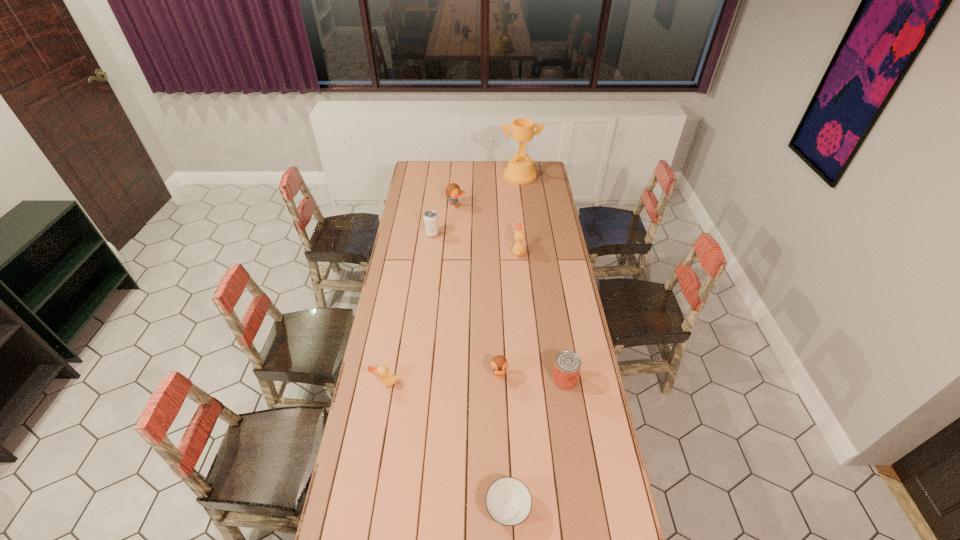
Where is `vacant region located 0.170m on the front of the third farthest object`? vacant region located 0.170m on the front of the third farthest object is located at coordinates (429, 260).

Locate an element on the screen. This screenshot has width=960, height=540. vacant region located on the back of the can is located at coordinates click(553, 307).

This screenshot has height=540, width=960. I want to click on free space located on the front-facing side of the smaller blue duck, so click(503, 487).

Image resolution: width=960 pixels, height=540 pixels. Identify the location of vacant region located on the beak of the smaller tan duck. (380, 417).

The image size is (960, 540). I want to click on vacant region located on the back of the shortest object, so click(x=503, y=410).

Find the location of a particular element. The width and height of the screenshot is (960, 540). object at the far edge is located at coordinates (520, 170).

This screenshot has width=960, height=540. I want to click on soda can that is at the left edge, so click(x=431, y=226).

Identify the location of duck that is at the left edge. The width and height of the screenshot is (960, 540). (387, 379).

At what (x,y) coordinates should I click in order to perform the action: click on award at the right edge. Please return your answer as a coordinate pair (x, y). Image resolution: width=960 pixels, height=540 pixels. Looking at the image, I should click on (520, 170).

Where is `can located at the right edge`? The height and width of the screenshot is (540, 960). can located at the right edge is located at coordinates (567, 365).